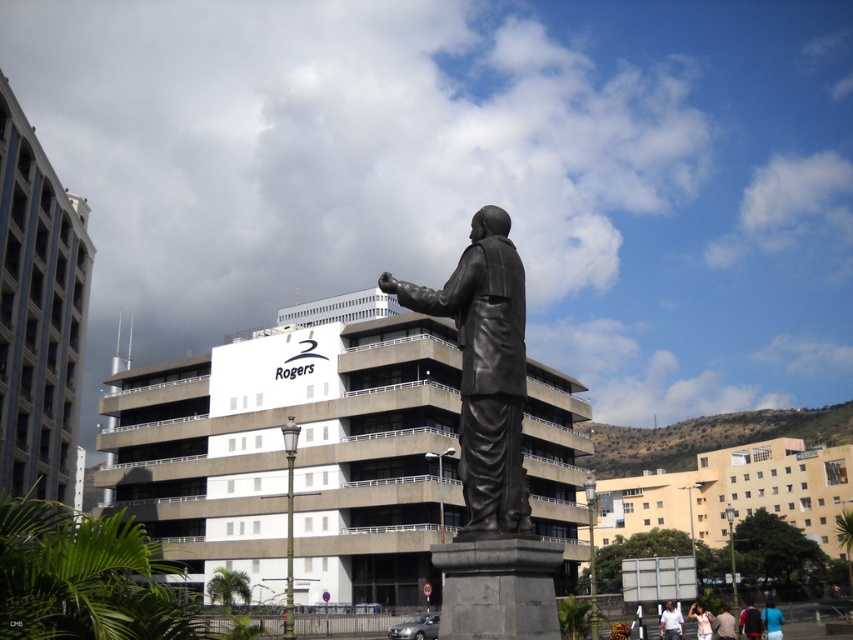
Question: Can you confirm if bronze statue at center is positioned below blue fabric shirt at lower right?

Choices:
 (A) yes
 (B) no

Answer: (B)

Question: Which object is the closest to the white shirt at lower center?

Choices:
 (A) light brown leather jacket at lower right
 (B) light beige shirt at lower right
 (C) blue fabric shirt at lower right

Answer: (B)

Question: Can you confirm if dark blue jacket at lower right is positioned to the right of blue fabric shirt at lower right?

Choices:
 (A) no
 (B) yes

Answer: (A)

Question: Which point is farther to the camera?

Choices:
 (A) (698, 621)
 (B) (677, 618)
 (C) (728, 608)
 (D) (770, 630)

Answer: (C)

Question: Which object is positioned farthest from the light brown leather jacket at lower right?

Choices:
 (A) bronze statue at center
 (B) dark blue jacket at lower right
 (C) white shirt at lower center
 (D) blue fabric shirt at lower right

Answer: (A)

Question: Is bronze statue at center below light brown leather jacket at lower right?

Choices:
 (A) no
 (B) yes

Answer: (A)